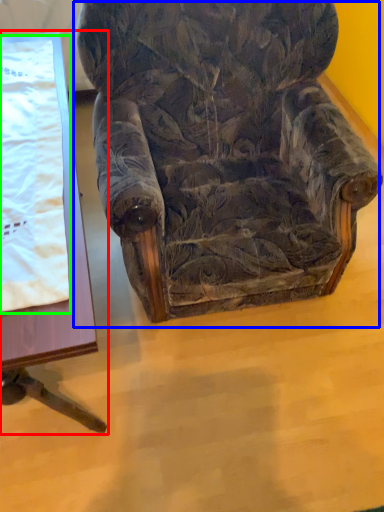
Question: Which object is positioned closest to table (highlighted by a red box)? Select from chair (highlighted by a blue box) and blanket (highlighted by a green box).

Choices:
 (A) chair
 (B) blanket

Answer: (B)